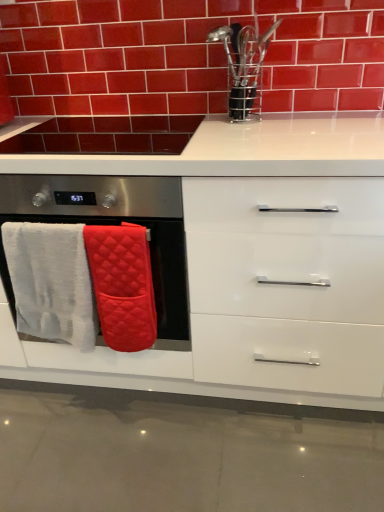
Question: Considering the relative sizes of white glossy cabinet at center and white quilted oven mitts at left in the image provided, is white glossy cabinet at center wider than white quilted oven mitts at left?

Choices:
 (A) no
 (B) yes

Answer: (B)

Question: Does white glossy cabinet at center come in front of white quilted oven mitts at left?

Choices:
 (A) yes
 (B) no

Answer: (A)

Question: Is white glossy cabinet at center further to camera compared to white quilted oven mitts at left?

Choices:
 (A) no
 (B) yes

Answer: (A)

Question: Is white glossy cabinet at center not near white quilted oven mitts at left?

Choices:
 (A) yes
 (B) no

Answer: (B)

Question: Can you confirm if white glossy cabinet at center is positioned to the right of white quilted oven mitts at left?

Choices:
 (A) no
 (B) yes

Answer: (B)

Question: Can you confirm if white glossy cabinet at center is bigger than white quilted oven mitts at left?

Choices:
 (A) yes
 (B) no

Answer: (A)

Question: Can you see glossy ceramic brick at upper center touching white quilted oven mitts at left?

Choices:
 (A) yes
 (B) no

Answer: (B)

Question: From the image's perspective, is glossy ceramic brick at upper center located above white quilted oven mitts at left?

Choices:
 (A) yes
 (B) no

Answer: (A)

Question: Does glossy ceramic brick at upper center have a greater height compared to white quilted oven mitts at left?

Choices:
 (A) yes
 (B) no

Answer: (B)

Question: Could you tell me if glossy ceramic brick at upper center is turned towards white quilted oven mitts at left?

Choices:
 (A) no
 (B) yes

Answer: (A)

Question: Is glossy ceramic brick at upper center facing away from white quilted oven mitts at left?

Choices:
 (A) no
 (B) yes

Answer: (A)

Question: Does glossy ceramic brick at upper center have a smaller size compared to white quilted oven mitts at left?

Choices:
 (A) no
 (B) yes

Answer: (B)

Question: Is white quilted oven mitts at left to the right of white fluffy bath towel at left, the first bath towel when ordered from left to right, from the viewer's perspective?

Choices:
 (A) no
 (B) yes

Answer: (B)